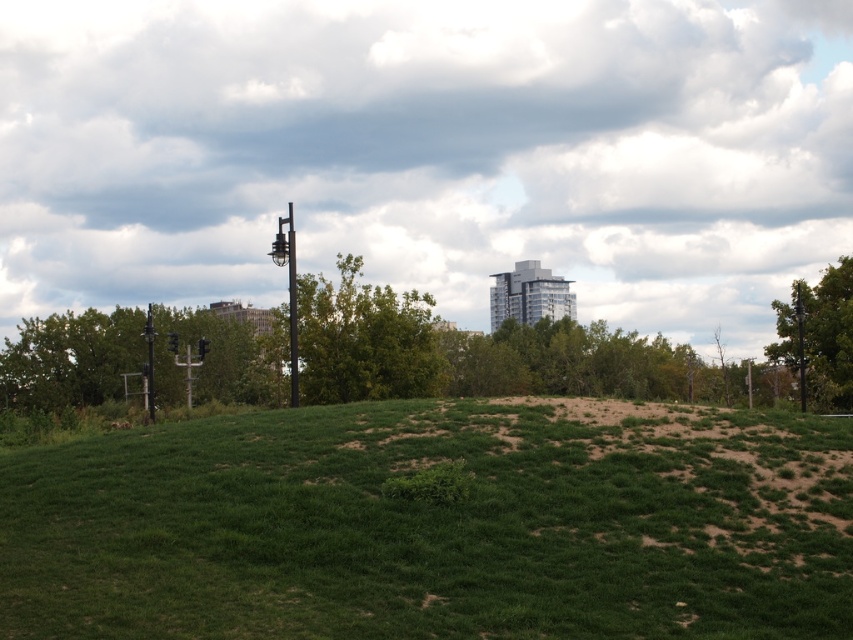
Is green grassy hill at center bigger than green leafy tree at left?

No.

Does point (236, 564) lie behind point (161, 353)?

No, it is not.

Is point (32, 566) positioned after point (71, 328)?

No, it is in front of (71, 328).

At what (x,y) coordinates should I click in order to perform the action: click on green grassy hill at center. Please return your answer as a coordinate pair (x, y). Looking at the image, I should click on (434, 525).

Between green leafy tree at left and green leafy tree at right, which one is positioned higher?

green leafy tree at right is higher up.

Which is in front, point (4, 403) or point (798, 285)?

Point (798, 285) is more forward.

Who is more forward, (39, 372) or (838, 371)?

Positioned in front is point (838, 371).

The height and width of the screenshot is (640, 853). Find the location of `green leafy tree at left`. green leafy tree at left is located at coordinates (70, 358).

From the picture: Measure the distance between green grassy hill at center and camera.

28.15 feet

Does green grassy hill at center appear under metallic pole at center?

Yes, green grassy hill at center is below metallic pole at center.

Is point (532, 612) in front of point (292, 260)?

Yes, it is.

Locate an element on the screen. The width and height of the screenshot is (853, 640). green grassy hill at center is located at coordinates (434, 525).